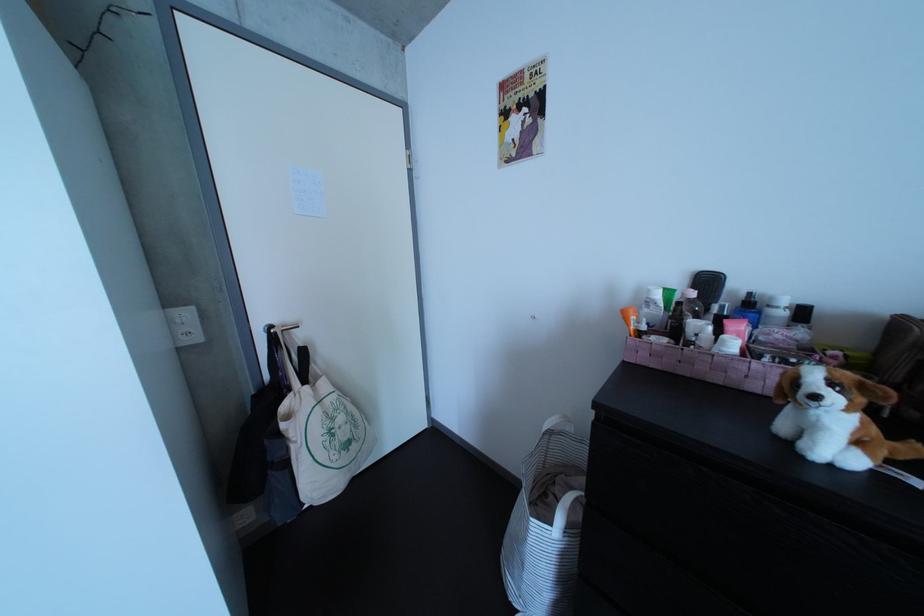
Where would you lift the striped basket handle? Please return your answer as a coordinate pair (x, y).

(551, 423)